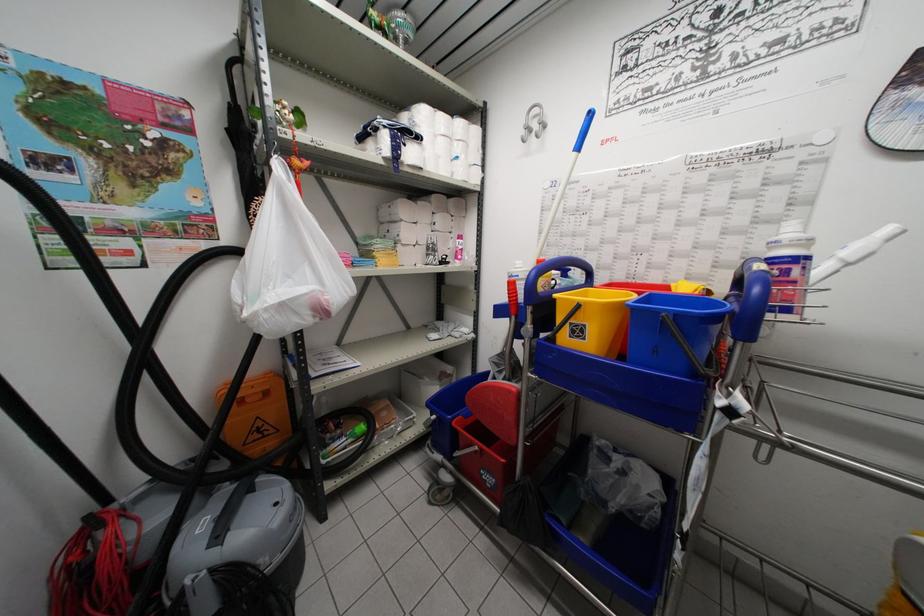
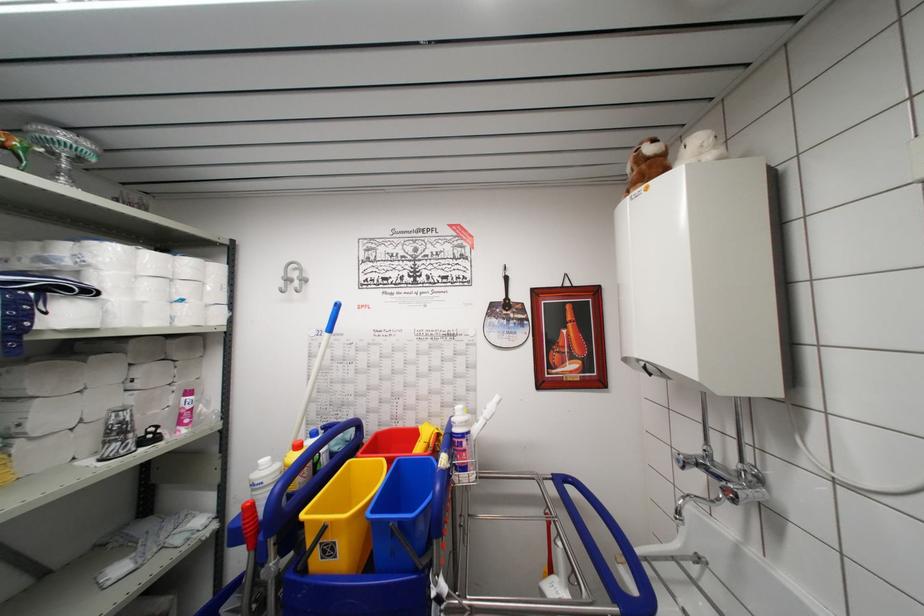
Locate, in the second image, the point that corresponds to the point at 524,282 in the first image.

(269, 488)